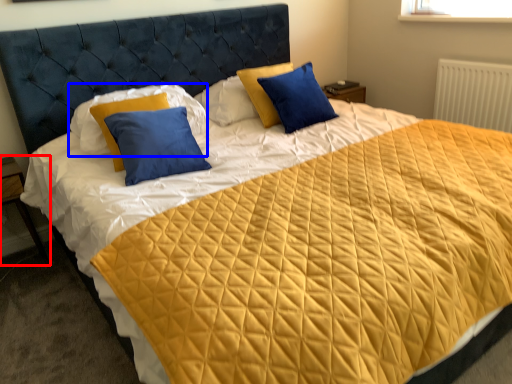
Question: Which object appears farthest to the camera in this image, nightstand (highlighted by a red box) or pillow (highlighted by a blue box)?

Choices:
 (A) nightstand
 (B) pillow

Answer: (A)